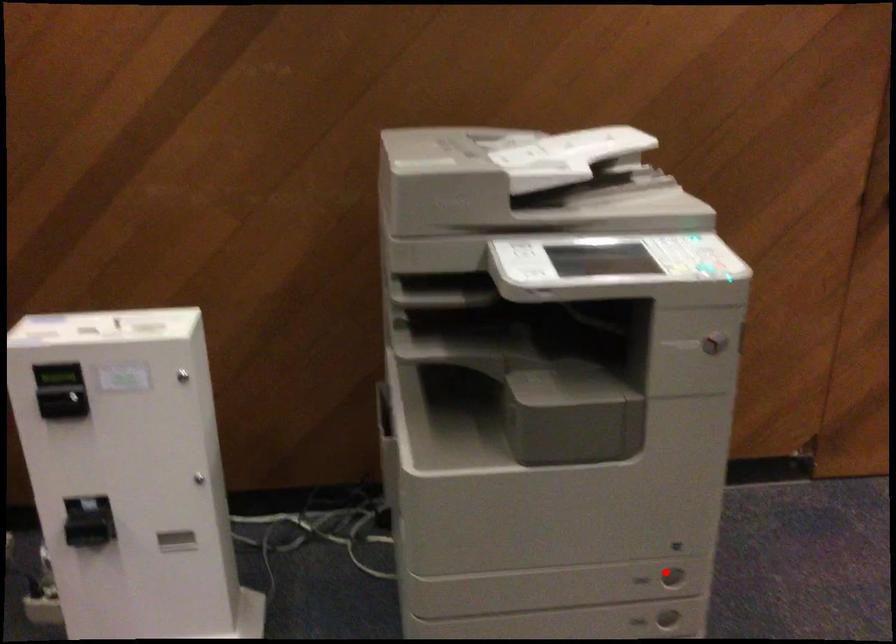
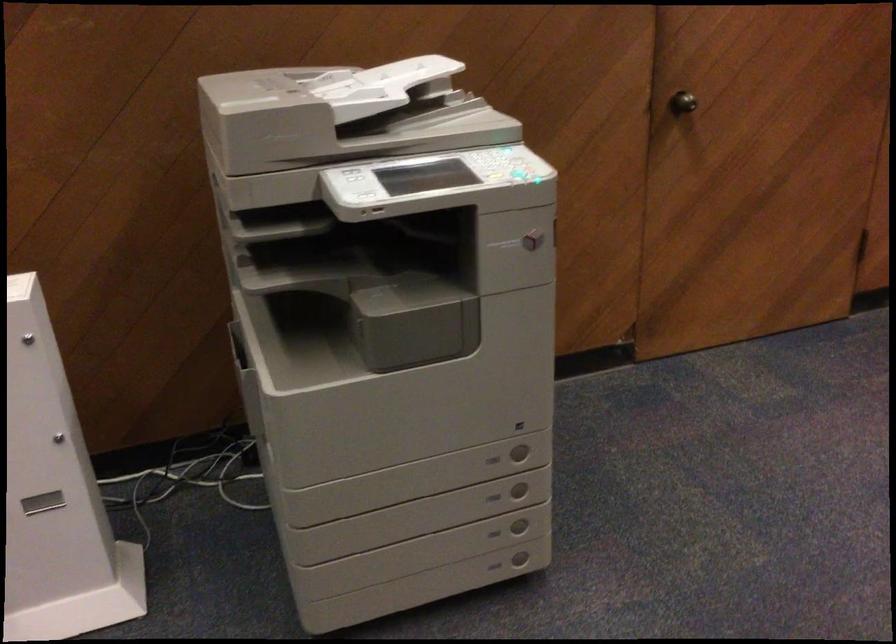
In the second image, find the point that corresponds to the highlighted location in the first image.

(519, 451)